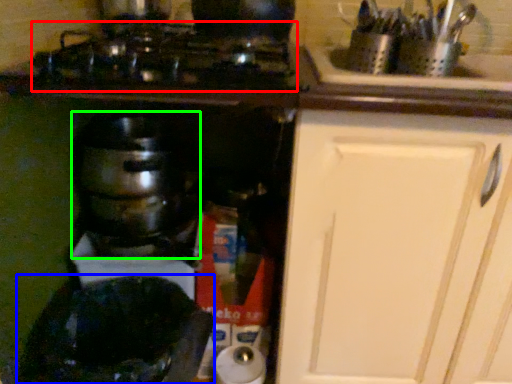
Question: Estimate the real-world distances between objects in this image. Which object is closer to gas stove (highlighted by a red box), appliance (highlighted by a blue box) or kitchen appliance (highlighted by a green box)?

Choices:
 (A) appliance
 (B) kitchen appliance

Answer: (B)